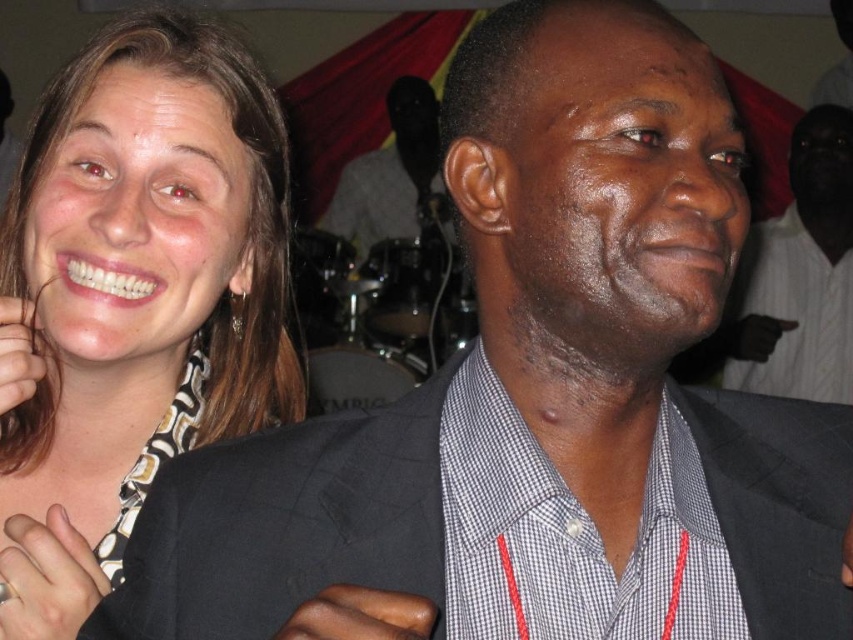
Does light brown leather hand at lower left appear under smooth skin hand at lower left?

Indeed, light brown leather hand at lower left is positioned under smooth skin hand at lower left.

Between light brown leather hand at lower left and smooth skin hand at lower left, which one has less height?

light brown leather hand at lower left

Find the location of a particular element. light brown leather hand at lower left is located at coordinates (47, 579).

Locate an element on the screen. This screenshot has width=853, height=640. light brown leather hand at lower left is located at coordinates (47, 579).

Between point (770, 241) and point (733, 352), which one is positioned behind?

The point (770, 241) is more distant.

Does matte black suit at center appear over dark gray fabric at right?

Yes, matte black suit at center is above dark gray fabric at right.

Which is behind, point (839, 211) or point (755, 352)?

The point (839, 211) is behind.

The image size is (853, 640). I want to click on matte black suit at center, so click(799, 275).

Describe the element at coordinates (138, 292) in the screenshot. I see `matte black suit at left` at that location.

Does matte black suit at left appear on the left side of dark gray fabric at right?

Indeed, matte black suit at left is positioned on the left side of dark gray fabric at right.

Who is more distant from viewer, (202, 195) or (763, 326)?

Point (763, 326)

This screenshot has width=853, height=640. Find the location of `matte black suit at left`. matte black suit at left is located at coordinates (138, 292).